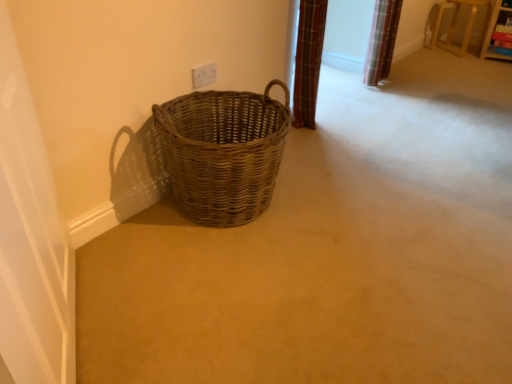
Where is `free location in front of woven brown basket at lower left`? Image resolution: width=512 pixels, height=384 pixels. free location in front of woven brown basket at lower left is located at coordinates (236, 291).